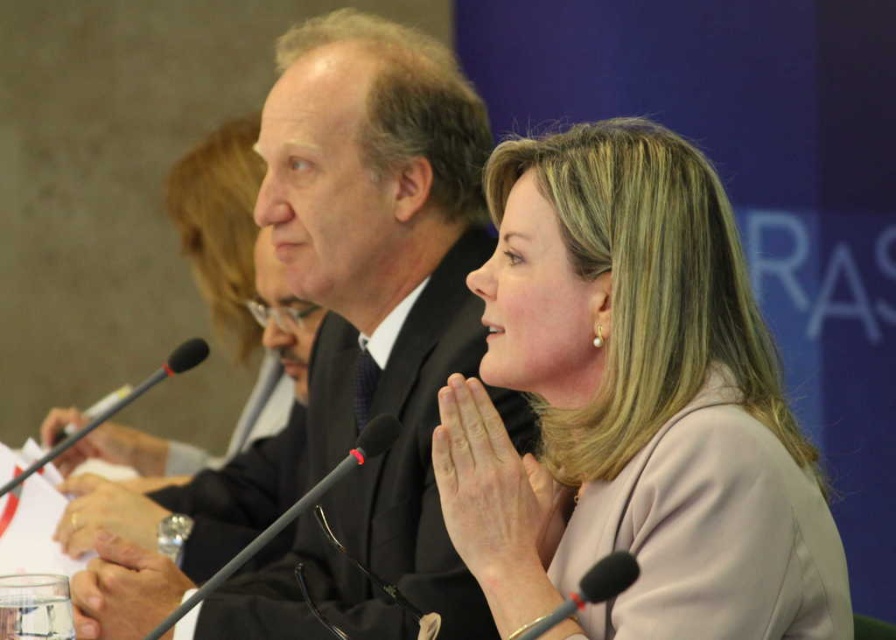
You are a photographer standing behind the matte black suit at center and want to take a photo of the black matte microphone at center. Can you reach the microphone without moving the suit?

The distance between the matte black suit at center and the black matte microphone at center is 57.54 centimeters. Since you are standing behind the suit, you can likely reach the microphone by extending your arm, as 57.54 cm is within typical human arm reach. However, this may depend on your specific arm length and flexibility.

You are a photographer at the event and need to capture a closeup of the matte black suit at center and the black matte microphone at lower center in a single frame. The camera you are using has a minimum focus distance of 30 inches. Can you achieve this without moving the camera or the subjects?

The matte black suit at center is 34.55 inches from the black matte microphone at lower center. Since the camera can focus as close as 30 inches, the distance between them is within the camera s minimum focus distance requirement. Therefore, you can capture both subjects in sharp focus in a single frame without moving anything.

You are an event organizer who needs to adjust the microphone height for the speaker wearing the matte black suit at center. Based on the scene description, can you determine if the black matte microphone at lower center is currently positioned too low for the speaker?

The matte black suit at center has a greater height compared to the black matte microphone at lower center. Therefore, the microphone is positioned too low for the speaker wearing the matte black suit at center and needs to be raised to ensure proper audio pickup.